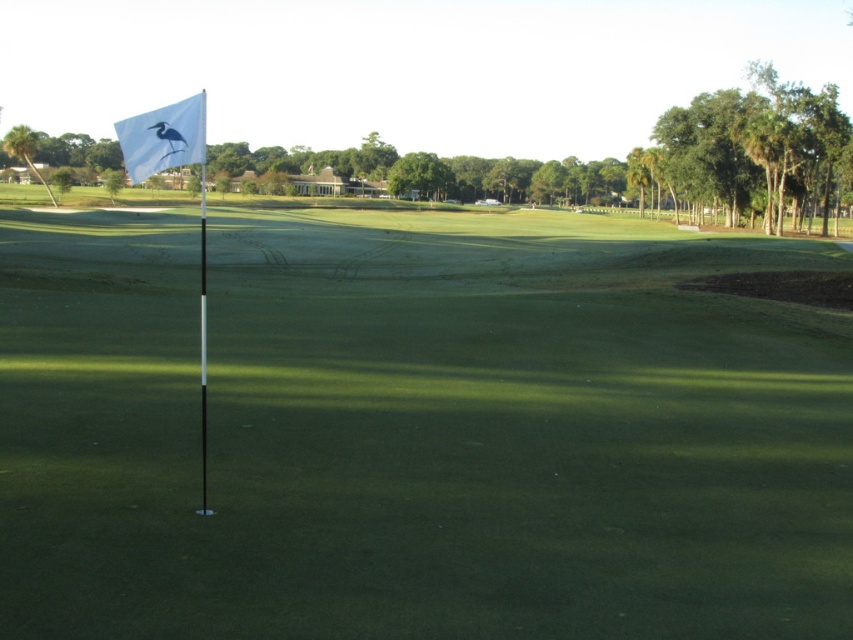
Question: Which point is farther to the camera?

Choices:
 (A) white fabric flag at upper left
 (B) white plastic flag at upper left

Answer: (A)

Question: Among these points, which one is farthest from the camera?

Choices:
 (A) (397, 627)
 (B) (196, 125)

Answer: (B)

Question: Is the position of white plastic flag at upper left less distant than that of white fabric flag at upper left?

Choices:
 (A) no
 (B) yes

Answer: (B)

Question: Which point is farther from the camera taking this photo?

Choices:
 (A) (225, 429)
 (B) (142, 124)

Answer: (A)

Question: Does white plastic flag at upper left have a greater width compared to white fabric flag at upper left?

Choices:
 (A) no
 (B) yes

Answer: (B)

Question: Can you confirm if white plastic flag at upper left is wider than white fabric flag at upper left?

Choices:
 (A) yes
 (B) no

Answer: (A)